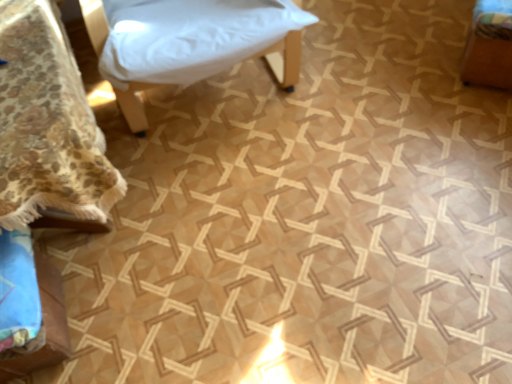
Question: Which direction should I rotate to look at white fabric cushion at upper center, acting as the third furniture starting from the left, — up or down?

Choices:
 (A) up
 (B) down

Answer: (A)

Question: From the image's perspective, would you say wooden box at right, acting as the 4th furniture starting from the left, is shown under floral fabric bedspread at lower left, which ranks as the first furniture in left-to-right order?

Choices:
 (A) yes
 (B) no

Answer: (B)

Question: Can you confirm if wooden box at right, acting as the 4th furniture starting from the left, is positioned to the left of floral fabric bedspread at lower left, arranged as the fourth furniture when viewed from the right?

Choices:
 (A) yes
 (B) no

Answer: (B)

Question: Does wooden box at right, which appears as the first furniture when viewed from the right, lie in front of floral fabric bedspread at lower left, which ranks as the first furniture in left-to-right order?

Choices:
 (A) yes
 (B) no

Answer: (B)

Question: Is wooden box at right, which appears as the first furniture when viewed from the right, looking in the opposite direction of floral fabric bedspread at lower left, which ranks as the first furniture in left-to-right order?

Choices:
 (A) yes
 (B) no

Answer: (B)

Question: Can you confirm if wooden box at right, acting as the 4th furniture starting from the left, is thinner than floral fabric bedspread at lower left, which ranks as the first furniture in left-to-right order?

Choices:
 (A) yes
 (B) no

Answer: (A)

Question: Does wooden box at right, acting as the 4th furniture starting from the left, have a greater width compared to floral fabric bedspread at lower left, arranged as the fourth furniture when viewed from the right?

Choices:
 (A) no
 (B) yes

Answer: (A)

Question: Does white fabric cushion at upper center, acting as the third furniture starting from the left, come behind floral fabric bedspread at lower left, arranged as the fourth furniture when viewed from the right?

Choices:
 (A) yes
 (B) no

Answer: (A)

Question: Does white fabric cushion at upper center, acting as the third furniture starting from the left, have a larger size compared to floral fabric bedspread at lower left, arranged as the fourth furniture when viewed from the right?

Choices:
 (A) no
 (B) yes

Answer: (B)

Question: From the image's perspective, is white fabric cushion at upper center, which is counted as the second furniture, starting from the right, located beneath floral fabric bedspread at lower left, which ranks as the first furniture in left-to-right order?

Choices:
 (A) yes
 (B) no

Answer: (B)

Question: Is white fabric cushion at upper center, which is counted as the second furniture, starting from the right, in contact with floral fabric bedspread at lower left, which ranks as the first furniture in left-to-right order?

Choices:
 (A) no
 (B) yes

Answer: (A)

Question: Considering the relative positions of white fabric cushion at upper center, which is counted as the second furniture, starting from the right, and floral fabric bedspread at lower left, which ranks as the first furniture in left-to-right order, in the image provided, is white fabric cushion at upper center, which is counted as the second furniture, starting from the right, to the left of floral fabric bedspread at lower left, which ranks as the first furniture in left-to-right order, from the viewer's perspective?

Choices:
 (A) no
 (B) yes

Answer: (A)

Question: Is white fabric cushion at upper center, which is counted as the second furniture, starting from the right, shorter than floral fabric bedspread at lower left, which ranks as the first furniture in left-to-right order?

Choices:
 (A) no
 (B) yes

Answer: (A)

Question: Is wooden box at right, acting as the 4th furniture starting from the left, inside floral fabric bedspread at lower left, which ranks as the first furniture in left-to-right order?

Choices:
 (A) no
 (B) yes

Answer: (A)